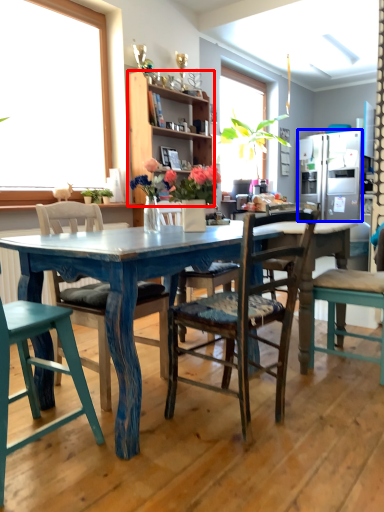
Question: Which object is closer to the camera taking this photo, cabinetry (highlighted by a red box) or refrigerator (highlighted by a blue box)?

Choices:
 (A) cabinetry
 (B) refrigerator

Answer: (A)